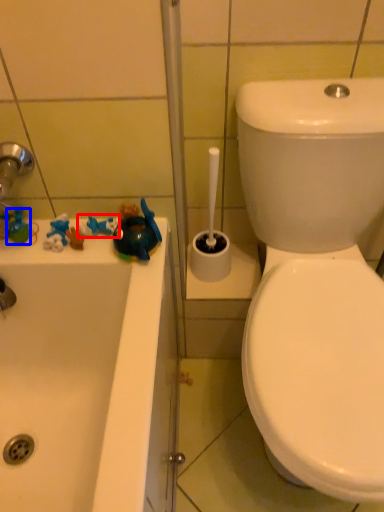
Question: Which of the following is the closest to the observer, toy (highlighted by a red box) or toy (highlighted by a blue box)?

Choices:
 (A) toy
 (B) toy

Answer: (A)